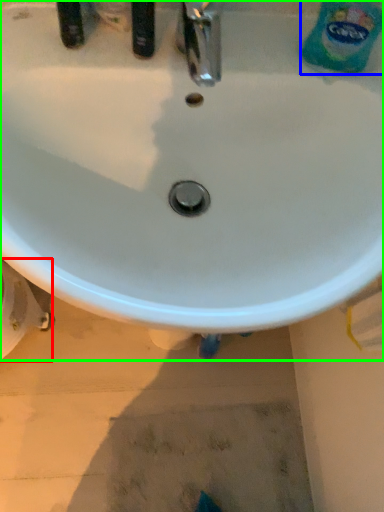
Question: Which object is positioned closest to bidet (highlighted by a red box)? Select from cleaning product (highlighted by a blue box) and sink (highlighted by a green box).

Choices:
 (A) cleaning product
 (B) sink

Answer: (B)